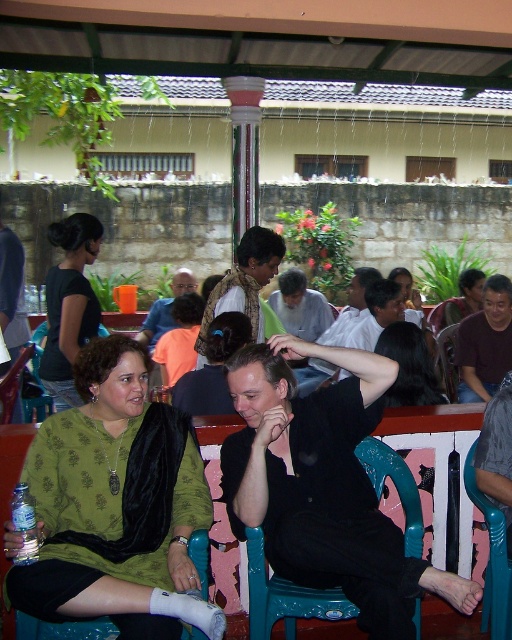
Question: Which of the following is the closest to the observer?

Choices:
 (A) (495, 604)
 (B) (263, 275)
 (C) (69, 380)

Answer: (A)

Question: Does black matte shirt at center appear on the right side of light gray fabric shirt at center?

Choices:
 (A) no
 (B) yes

Answer: (B)

Question: Among these points, which one is farthest from the camera?

Choices:
 (A) (407, 403)
 (B) (236, 284)
 (C) (502, 342)

Answer: (C)

Question: Considering the real-world distances, which object is farthest from the dark brown hair at center?

Choices:
 (A) black matte shirt at center
 (B) matte black shirt at upper left
 (C) light gray fabric shirt at center
 (D) matte green scarf at center

Answer: (C)

Question: Does teal plastic chair at center lie in front of black hair at center?

Choices:
 (A) no
 (B) yes

Answer: (B)

Question: Can you confirm if teal plastic chair at lower right is positioned below light gray fabric shirt at center?

Choices:
 (A) yes
 (B) no

Answer: (A)